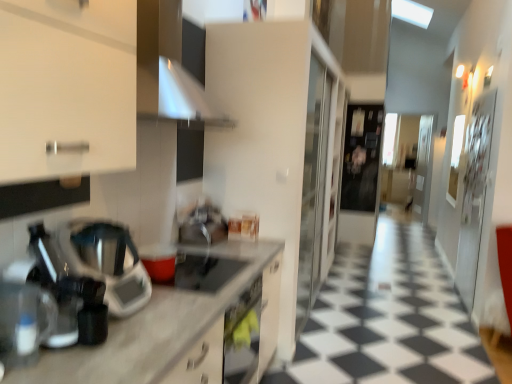
The height and width of the screenshot is (384, 512). Identify the location of blank space situated above white marble countertop at left (from a real-world perspective). (194, 278).